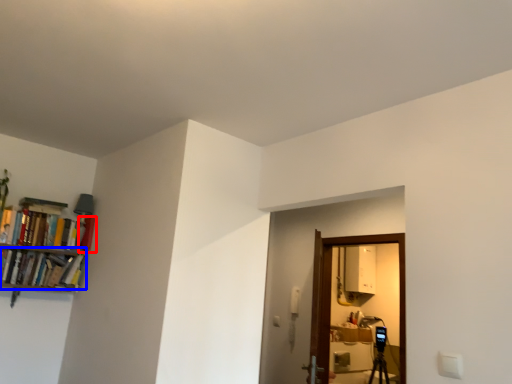
Question: Which object appears farthest to the camera in this image, book (highlighted by a red box) or book (highlighted by a blue box)?

Choices:
 (A) book
 (B) book

Answer: (A)